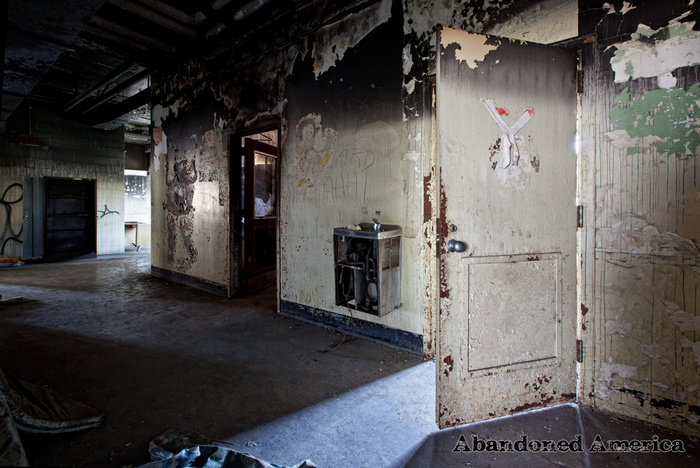
Where is `door`? door is located at coordinates (493, 227).